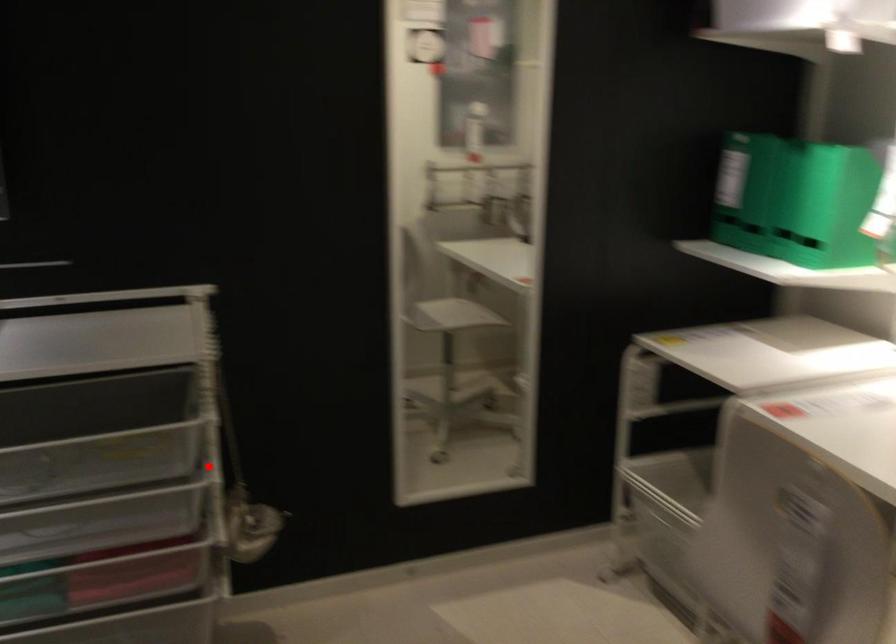
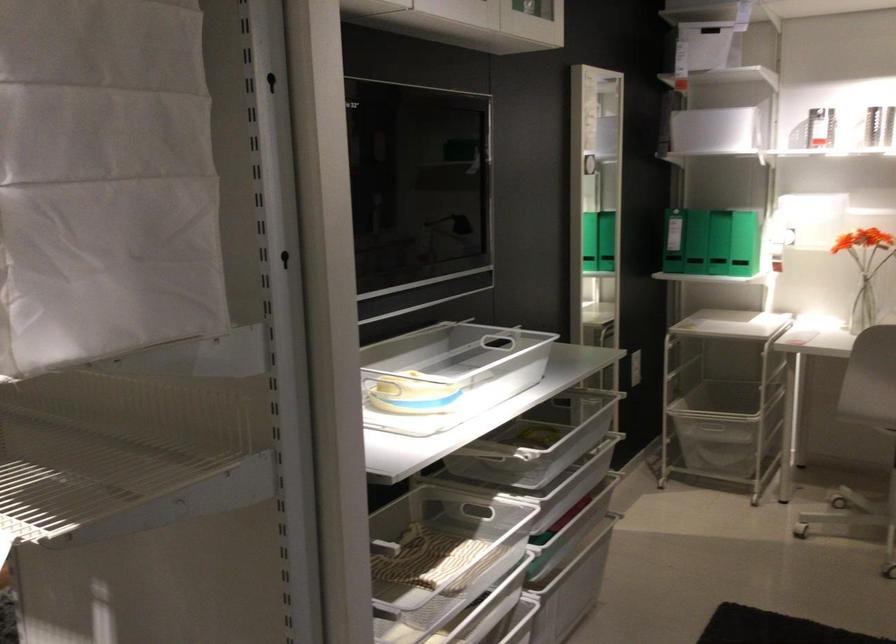
Question: I am providing you with two images of the same scene from different viewpoints. In image1, a red point is highlighted. Considering the same 3D point in image2, which of the following is correct?

Choices:
 (A) It is closer
 (B) It is farther

Answer: (B)